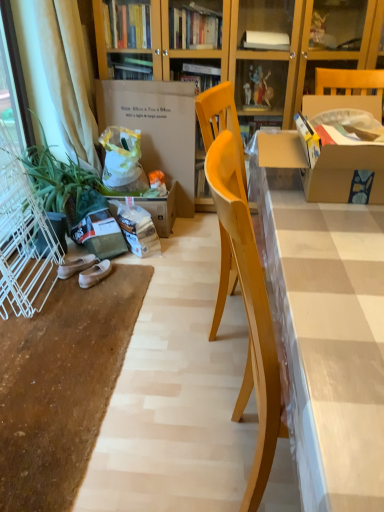
Question: Is white suede shoes at lower left, which is counted as the 2th footwear, starting from the left, thinner than beige fabric curtain at left?

Choices:
 (A) no
 (B) yes

Answer: (B)

Question: Does white suede shoes at lower left, the 1th footwear positioned from the right, have a larger size compared to beige fabric curtain at left?

Choices:
 (A) no
 (B) yes

Answer: (A)

Question: Can you confirm if white suede shoes at lower left, which is counted as the 2th footwear, starting from the left, is smaller than beige fabric curtain at left?

Choices:
 (A) yes
 (B) no

Answer: (A)

Question: Does white suede shoes at lower left, the 1th footwear positioned from the right, have a greater height compared to beige fabric curtain at left?

Choices:
 (A) no
 (B) yes

Answer: (A)

Question: From a real-world perspective, is white suede shoes at lower left, which is counted as the 2th footwear, starting from the left, positioned over beige fabric curtain at left based on gravity?

Choices:
 (A) no
 (B) yes

Answer: (A)

Question: From a real-world perspective, is matte cardboard desk at center physically located above or below white wire screen door at left?

Choices:
 (A) below
 (B) above

Answer: (A)

Question: Do you think matte cardboard desk at center is within white wire screen door at left, or outside of it?

Choices:
 (A) outside
 (B) inside

Answer: (A)

Question: Relative to white wire screen door at left, is matte cardboard desk at center in front or behind?

Choices:
 (A) behind
 (B) front

Answer: (B)

Question: Is point (302, 326) positioned closer to the camera than point (11, 246)?

Choices:
 (A) closer
 (B) farther

Answer: (A)

Question: Considering the positions of point (110, 264) and point (46, 159), is point (110, 264) closer or farther from the camera than point (46, 159)?

Choices:
 (A) closer
 (B) farther

Answer: (A)

Question: Looking at their shapes, would you say white suede shoes at lower left, which is counted as the 2th footwear, starting from the left, is wider or thinner than green matte plant at left?

Choices:
 (A) thin
 (B) wide

Answer: (A)

Question: From a real-world perspective, relative to green matte plant at left, is white suede shoes at lower left, the 1th footwear positioned from the right, vertically above or below?

Choices:
 (A) above
 (B) below

Answer: (B)

Question: From the image's perspective, is white suede shoes at lower left, which is counted as the 2th footwear, starting from the left, located above or below green matte plant at left?

Choices:
 (A) above
 (B) below

Answer: (B)

Question: In the image, is matte cardboard desk at center positioned in front of or behind beige fabric curtain at left?

Choices:
 (A) front
 (B) behind

Answer: (A)

Question: From their relative heights in the image, would you say matte cardboard desk at center is taller or shorter than beige fabric curtain at left?

Choices:
 (A) tall
 (B) short

Answer: (B)